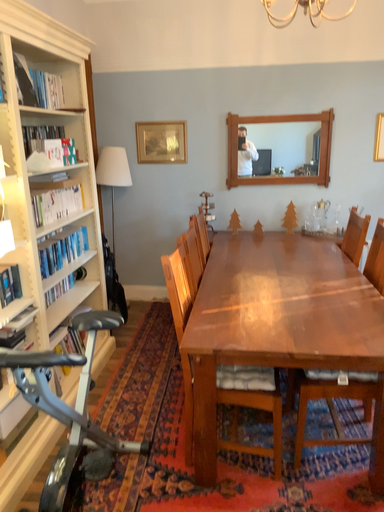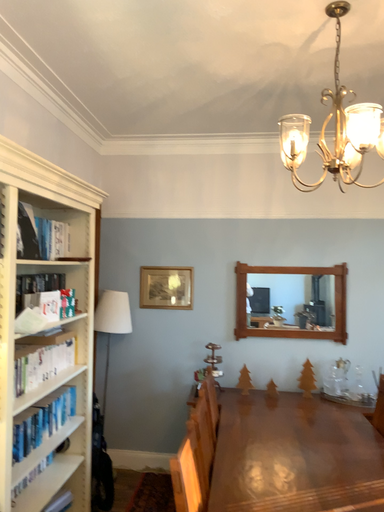
Question: How did the camera likely rotate when shooting the video?

Choices:
 (A) rotated upward
 (B) rotated downward

Answer: (A)